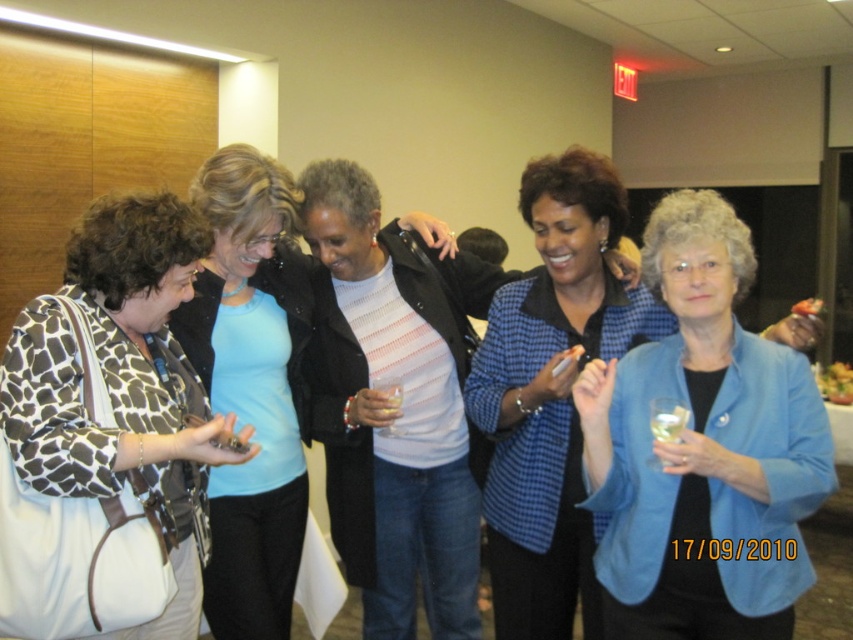
You are a photographer setting up for a group photo. You notice the brown giraffe print coat at left and the clear glass at center. Which object is taller? Please answer based on their heights.

The brown giraffe print coat at left is taller than the clear glass at center.

You are organizing a photo shoot and need to arrange the blue fabric jacket at right and the light blue shirt at center in a row. Based on their widths, which should be placed first if you want the wider item on the left?

The blue fabric jacket at right should be placed first on the left since it might be wider than the light blue shirt at center.

In the image of the group of women in the conference room, where is the light blue shirt at center located in terms of coordinates?

The light blue shirt at center is located at coordinates point (252, 387).